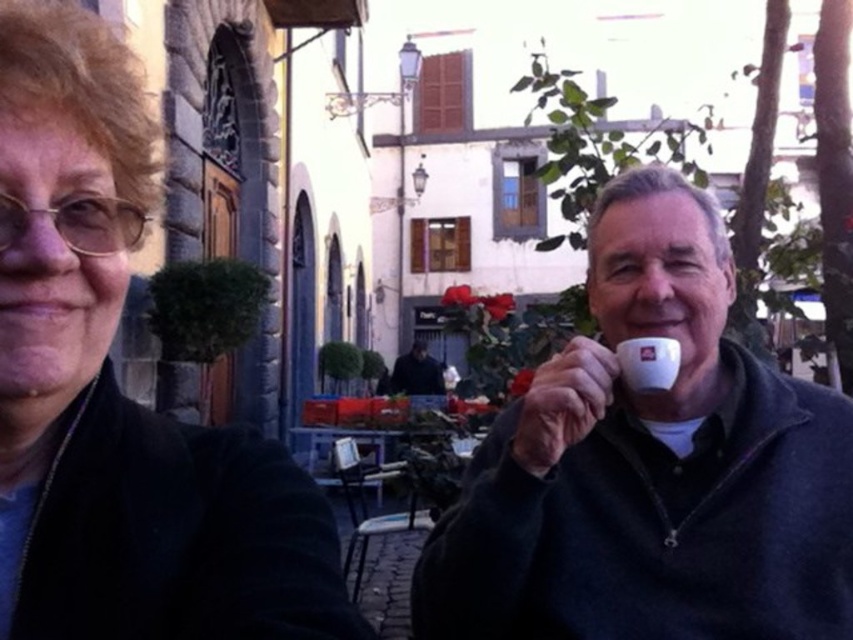
You are a photographer trying to capture a group photo of the matte black jacket at left and the dark blue sweater at center. Since you want to ensure both subjects are clearly visible, which object should you focus on to avoid blurring due to their size difference?

The matte black jacket at left occupies less space than the dark blue sweater at center, so you should focus on the dark blue sweater at center to ensure it is in sharp focus while the smaller matte black jacket at left remains clear as well.

You are a photographer taking a picture of the scene. You notice the white ceramic cup at right and the dark blue sweater at center. Which object is taller in the image?

The white ceramic cup at right is taller than the dark blue sweater at center.

You are a photographer standing in front of the European street scene. You notice the white ceramic cup at right and the matte black jacket at left. Which object appears bigger in the photo?

The white ceramic cup at right appears larger than the matte black jacket at left in the photo.